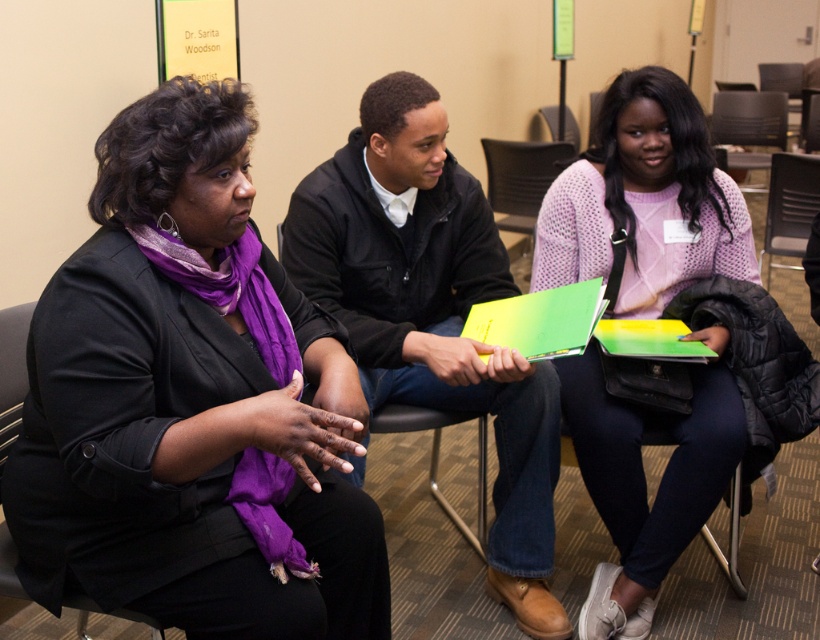
Question: Which of the following is the farthest from the observer?

Choices:
 (A) (681, 152)
 (B) (784, 189)
 (C) (727, 150)

Answer: (C)

Question: Does black fabric chair at left appear over black leather chair at center?

Choices:
 (A) no
 (B) yes

Answer: (B)

Question: Among these objects, which one is nearest to the camera?

Choices:
 (A) black leather chair at center
 (B) black matte jacket at center
 (C) pink knitted sweater at center
 (D) black fabric chair at left

Answer: (D)

Question: Which object is farther from the camera taking this photo?

Choices:
 (A) pink knitted sweater at center
 (B) black fabric chair at left
 (C) black matte jacket at center

Answer: (A)

Question: Where is black matte jacket at center located in relation to gray plastic chair at center in the image?

Choices:
 (A) above
 (B) below

Answer: (B)

Question: Does black fabric chair at left appear on the right side of matte black chair at center?

Choices:
 (A) no
 (B) yes

Answer: (A)